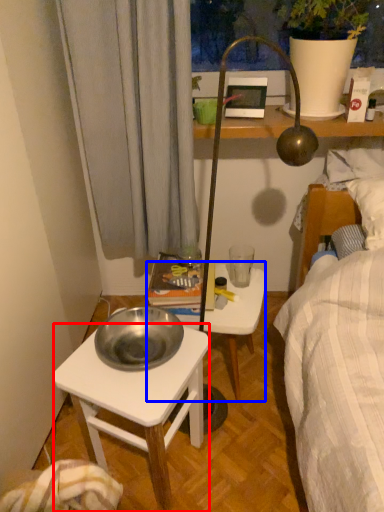
Question: Which object is closer to the camera taking this photo, desk (highlighted by a red box) or stool (highlighted by a blue box)?

Choices:
 (A) desk
 (B) stool

Answer: (A)